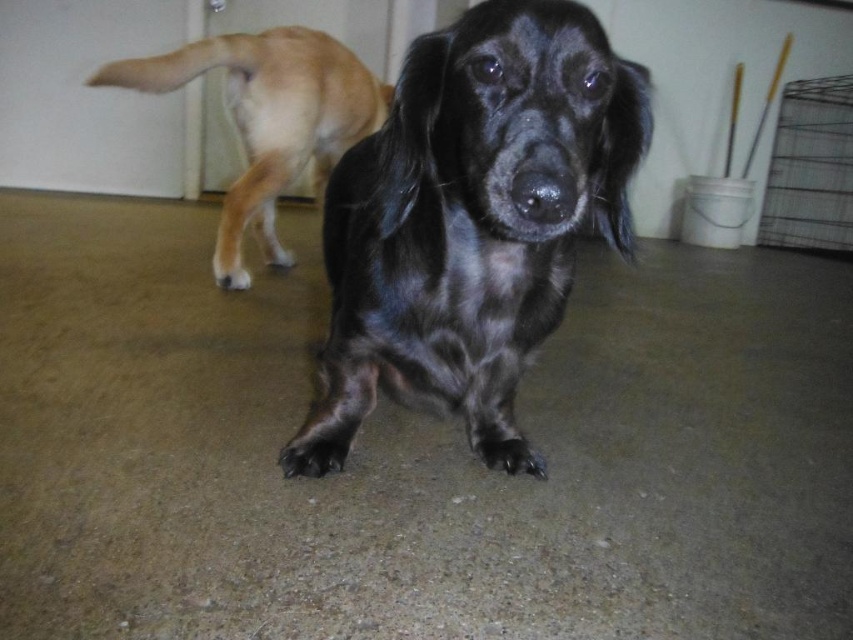
You are a photographer trying to capture both the shiny black dog at center and the shiny brown fur at upper left in a single frame. Based on their positions, which dog should you focus on first to ensure both are in focus?

The shiny black dog at center is below the shiny brown fur at upper left, so you should focus on the shiny brown fur at upper left first to ensure both are in focus since it is higher up and the depth of field might capture the lower dog naturally.

You are a photographer trying to capture both the shiny black dog at center and the shiny brown fur at upper left in a single shot. Which dog should you focus on first to ensure both are in focus?

You should focus on the shiny black dog at center first because it is closer to the viewer than the shiny brown fur at upper left, so focusing on the closer subject will help both be in focus.